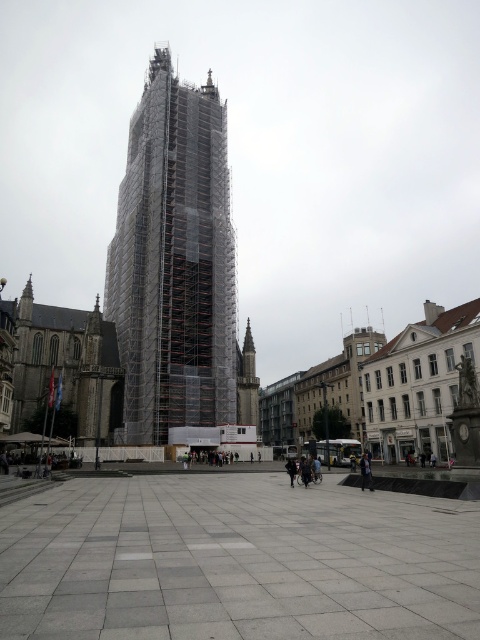
Question: Is dark blue fabric jacket at lower right below black leather jacket at lower center?

Choices:
 (A) no
 (B) yes

Answer: (A)

Question: From the image, what is the correct spatial relationship of gray concrete pavement at center in relation to dark blue fabric jacket at lower right?

Choices:
 (A) right
 (B) left

Answer: (B)

Question: Which object appears farthest from the camera in this image?

Choices:
 (A) black leather jacket at lower center
 (B) gray concrete pavement at center
 (C) dark blue fabric jacket at lower right

Answer: (A)

Question: Which of the following is the farthest from the observer?

Choices:
 (A) (225, 268)
 (B) (372, 483)

Answer: (A)

Question: Based on their relative distances, which object is farther from the black leather jacket at lower center?

Choices:
 (A) gray concrete pavement at center
 (B) dark blue fabric jacket at lower right
 (C) scaffolding at center

Answer: (C)

Question: In this image, where is scaffolding at center located relative to black leather jacket at lower center?

Choices:
 (A) right
 (B) left

Answer: (B)